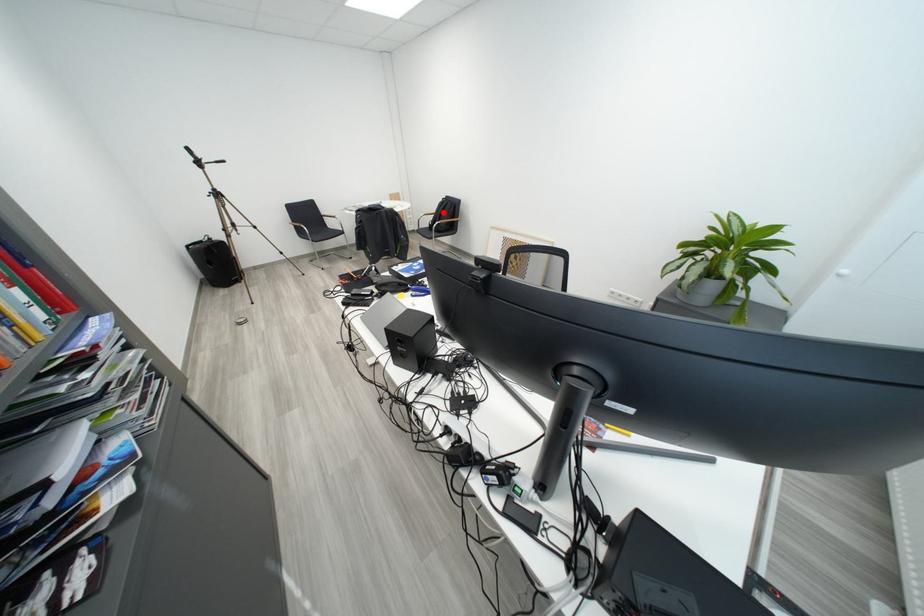
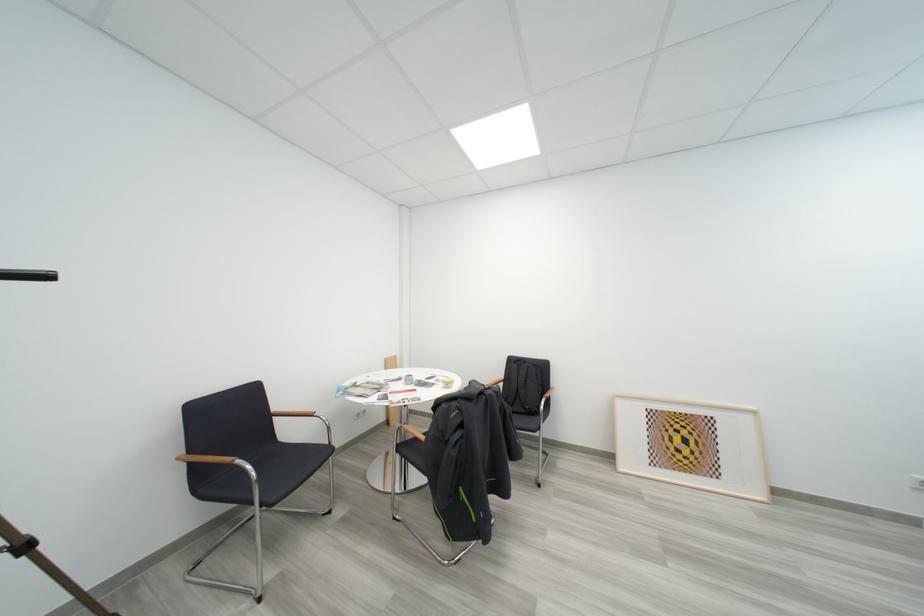
Question: I am providing you with two images of the same scene from different viewpoints. A red point is shown in image1. For the corresponding object point in image2, is it positioned nearer or farther from the camera?

Choices:
 (A) Nearer
 (B) Farther

Answer: (B)